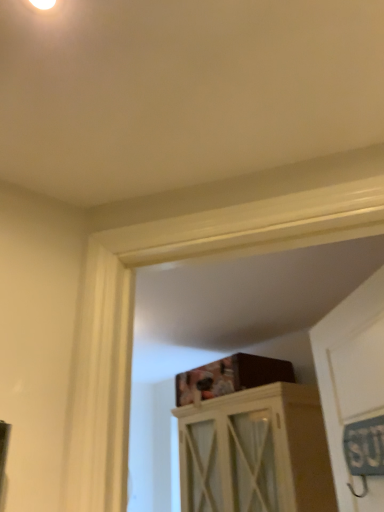
Image resolution: width=384 pixels, height=512 pixels. Identify the location of white wood cabinet at upper center. (256, 452).

Describe the element at coordinates (256, 452) in the screenshot. I see `white wood cabinet at upper center` at that location.

The width and height of the screenshot is (384, 512). Find the location of `white wood cabinet at upper center`. white wood cabinet at upper center is located at coordinates (256, 452).